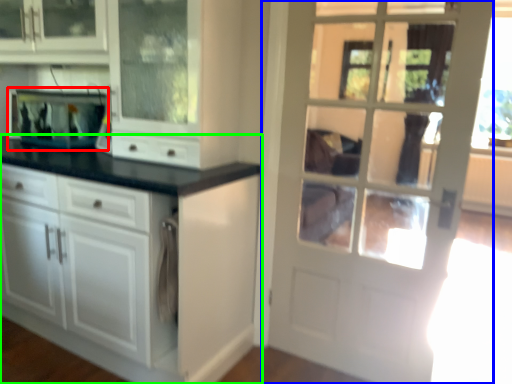
Question: Based on their relative distances, which object is farther from appliance (highlighted by a red box)? Choose from door (highlighted by a blue box) and cabinetry (highlighted by a green box).

Choices:
 (A) door
 (B) cabinetry

Answer: (A)